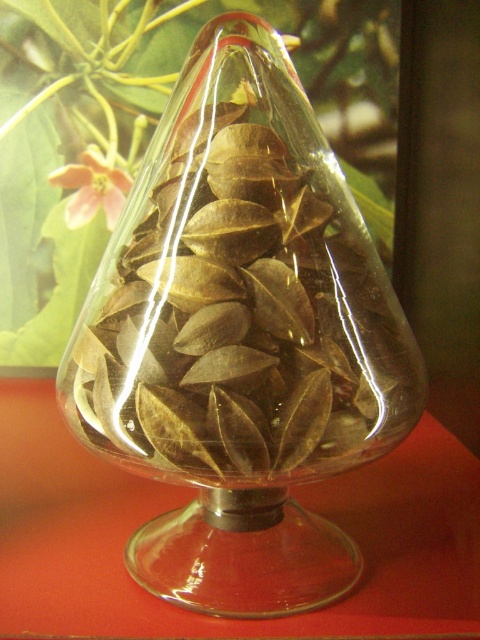
You are a botanist examining the conical glass container with dried leaves. You notice two points marked on the flask. Based on their positions, which point is closer to you, point [204,340] or point [117,202]?

Point [204,340] is in front of point [117,202], so it is closer to you.

You are arranging flowers in a transparent glass vase at center and placing a pink matte flower at upper left. Which object has a larger width?

The transparent glass vase at center is wider than the pink matte flower at upper left.